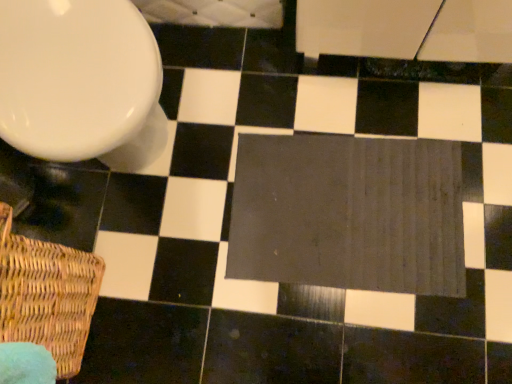
Identify the location of vacant space to the right of woven brown basket at lower left. (169, 288).